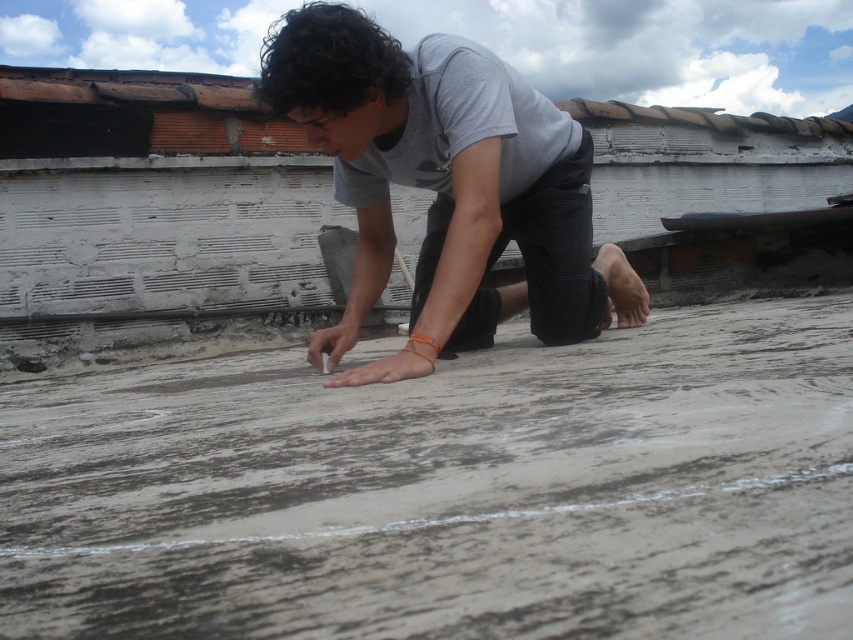
You are a safety inspector assessing the rooftop scene. The gray concrete at center is where the worker is crouched, and the gray matte shirt at center is part of their attire. Based on the spatial relationship between these two objects, is the worker positioned correctly to avoid slipping off the edge of the roof?

The gray concrete at center is in front of the gray matte shirt at center, meaning the worker is positioned with the edge of the roof behind them. This placement reduces the risk of slipping off the edge since their body is oriented away from the edge.

While observing the person on the rooftop, which object is lower in height between the gray concrete at center and the gray matte shirt at center?

The gray concrete at center is lower in height compared to the gray matte shirt at center.